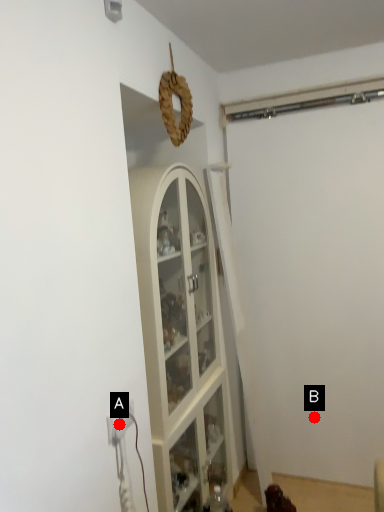
Question: Two points are circled on the image, labeled by A and B beside each circle. Which point is farther to the camera?

Choices:
 (A) A is further
 (B) B is further

Answer: (B)